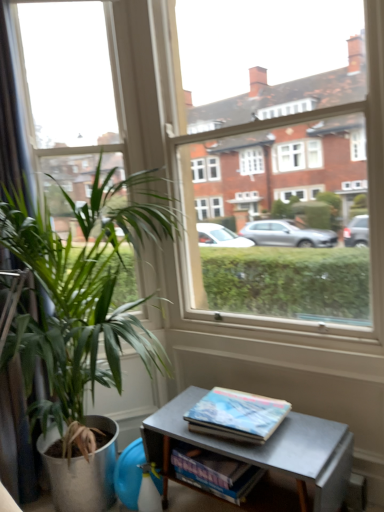
Question: Does blue glossy book at lower center have a smaller size compared to clear glass window at center?

Choices:
 (A) no
 (B) yes

Answer: (B)

Question: Is blue glossy book at lower center taller than clear glass window at center?

Choices:
 (A) no
 (B) yes

Answer: (A)

Question: Is blue glossy book at lower center behind clear glass window at center?

Choices:
 (A) no
 (B) yes

Answer: (B)

Question: From the image's perspective, does blue glossy book at lower center appear higher than clear glass window at center?

Choices:
 (A) yes
 (B) no

Answer: (B)

Question: Are blue glossy book at lower center and clear glass window at center far apart?

Choices:
 (A) no
 (B) yes

Answer: (A)

Question: From a real-world perspective, is blue glossy book at lower center positioned over clear glass window at center based on gravity?

Choices:
 (A) yes
 (B) no

Answer: (B)

Question: From a real-world perspective, is blue glossy book at lower center physically above metallic gray table at lower right?

Choices:
 (A) no
 (B) yes

Answer: (B)

Question: From the image's perspective, does blue glossy book at lower center appear higher than metallic gray table at lower right?

Choices:
 (A) no
 (B) yes

Answer: (B)

Question: Does blue glossy book at lower center have a larger size compared to metallic gray table at lower right?

Choices:
 (A) yes
 (B) no

Answer: (B)

Question: Does blue glossy book at lower center have a lesser height compared to metallic gray table at lower right?

Choices:
 (A) no
 (B) yes

Answer: (B)

Question: Does blue glossy book at lower center have a greater width compared to metallic gray table at lower right?

Choices:
 (A) no
 (B) yes

Answer: (A)

Question: Is metallic gray table at lower right surrounded by blue glossy book at lower center?

Choices:
 (A) yes
 (B) no

Answer: (B)

Question: Is green leafy plant at left positioned with its back to clear glass window at center?

Choices:
 (A) yes
 (B) no

Answer: (A)